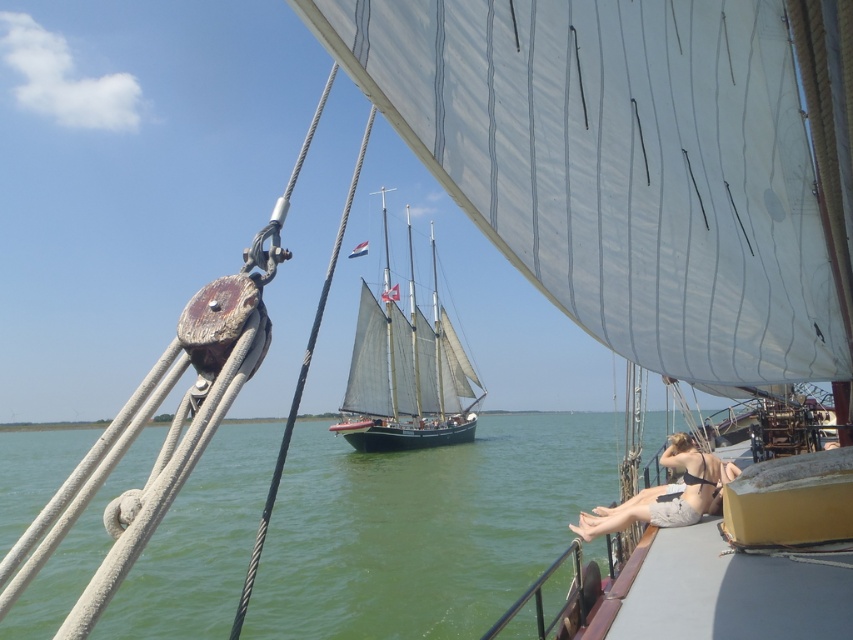
Can you confirm if green water at lower center is smaller than tan bikini top at center?

Actually, green water at lower center might be larger than tan bikini top at center.

Does point (402, 496) come behind point (628, 502)?

Yes, it is.

Identify the location of green water at lower center. (424, 528).

Can you confirm if dark blue wooden sailboat at center is positioned to the left of tan bikini top at center?

Yes, dark blue wooden sailboat at center is to the left of tan bikini top at center.

Who is taller, dark blue wooden sailboat at center or tan bikini top at center?

dark blue wooden sailboat at center

Who is more distant from viewer, (384, 420) or (579, 531)?

The point (384, 420) is behind.

Find the location of a particular element. dark blue wooden sailboat at center is located at coordinates (405, 378).

Is green water at lower center shorter than dark blue wooden sailboat at center?

Incorrect, green water at lower center's height does not fall short of dark blue wooden sailboat at center's.

Does point (200, 472) lie in front of point (383, 204)?

Yes, it is.

In order to click on green water at lower center in this screenshot , I will do `click(424, 528)`.